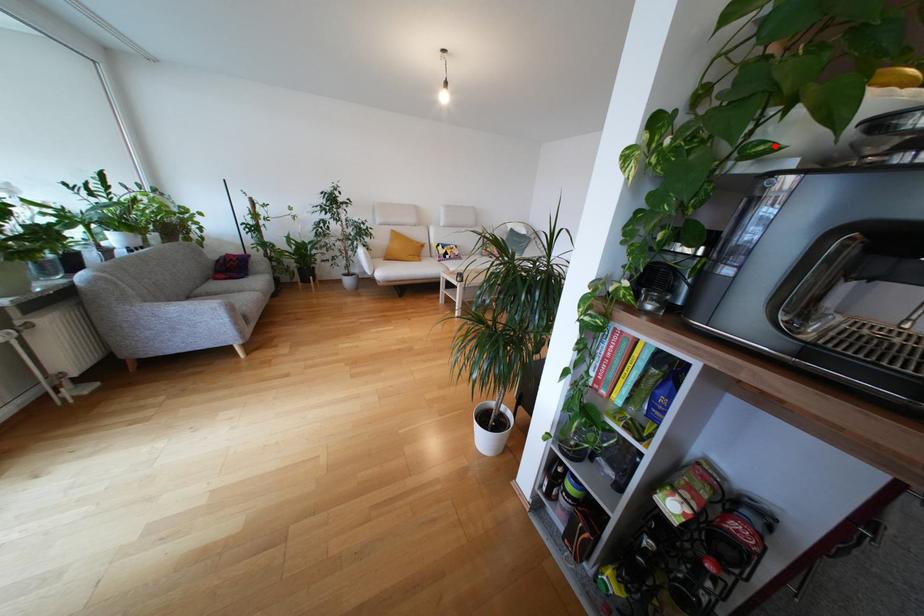
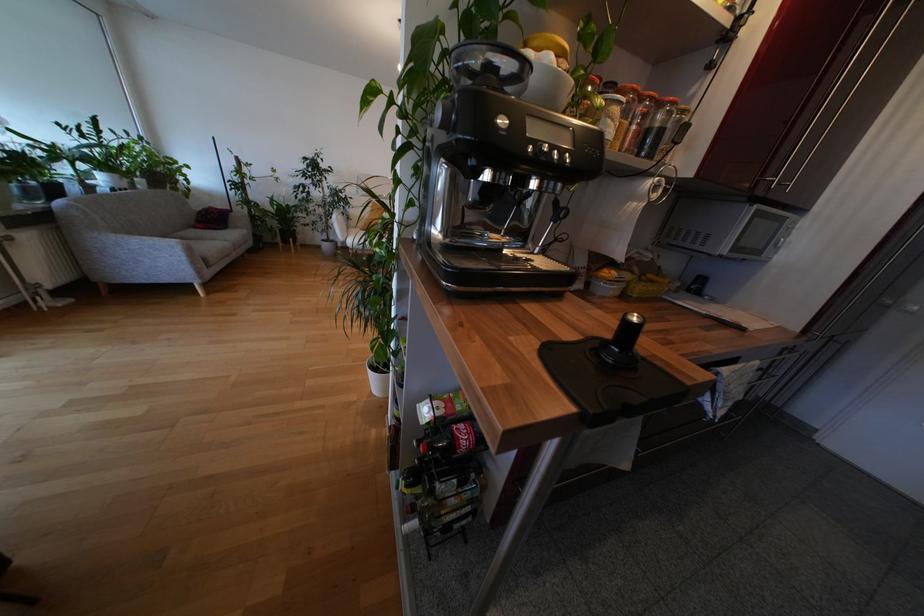
Locate, in the second image, the point that corresponds to the highlighted location in the first image.

(450, 95)